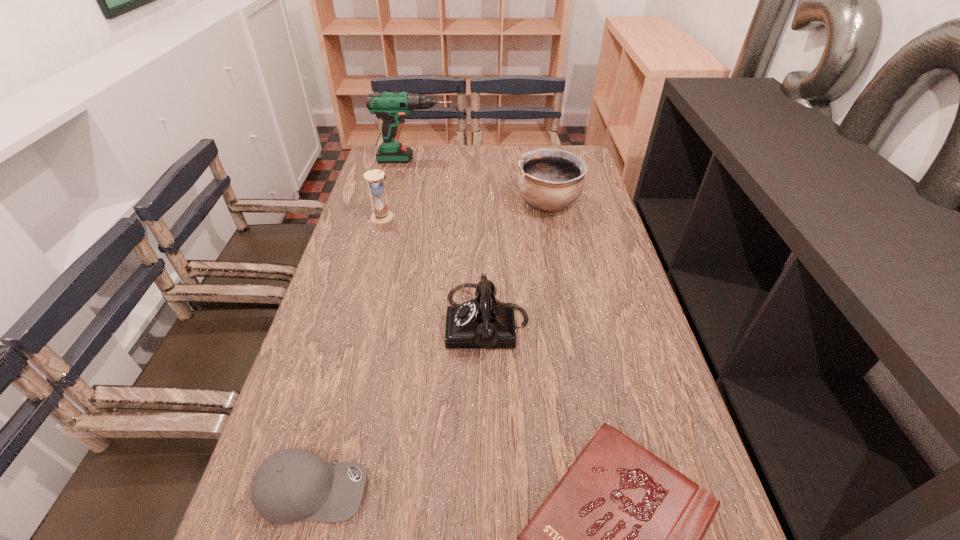
This screenshot has height=540, width=960. Identify the location of blank space located 0.090m on the dial of the fourth farthest object. (410, 323).

At what (x,y) coordinates should I click in order to perform the action: click on vacant area situated on the dial of the fourth farthest object. Please return your answer as a coordinate pair (x, y). The image size is (960, 540). Looking at the image, I should click on (372, 323).

Find the location of a particular element. The width and height of the screenshot is (960, 540). free space located on the dial of the fourth farthest object is located at coordinates (401, 323).

What are the coordinates of `vacant space situated on the front brim of the fifth tallest object` in the screenshot? It's located at (456, 490).

The width and height of the screenshot is (960, 540). I want to click on object located at the far edge, so click(392, 106).

Identify the location of drill at the left edge. (392, 106).

I want to click on hourglass at the left edge, so click(375, 178).

At what (x,y) coordinates should I click in order to perform the action: click on baseball cap that is at the left edge. Please return your answer as a coordinate pair (x, y). The width and height of the screenshot is (960, 540). Looking at the image, I should click on (291, 485).

At what (x,y) coordinates should I click in order to perform the action: click on object present at the right edge. Please return your answer as a coordinate pair (x, y). This screenshot has height=540, width=960. Looking at the image, I should click on (548, 179).

Identify the location of object present at the far left corner. (392, 106).